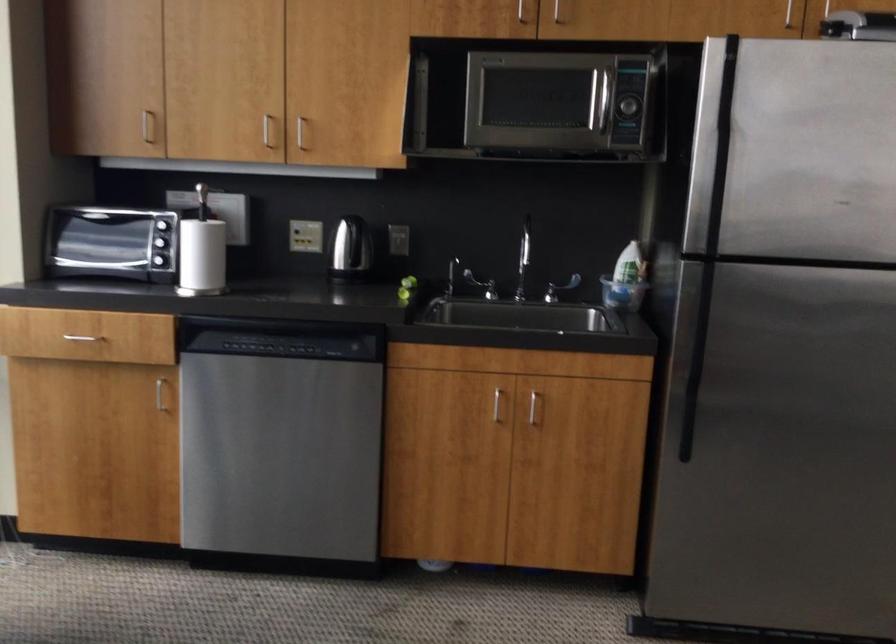
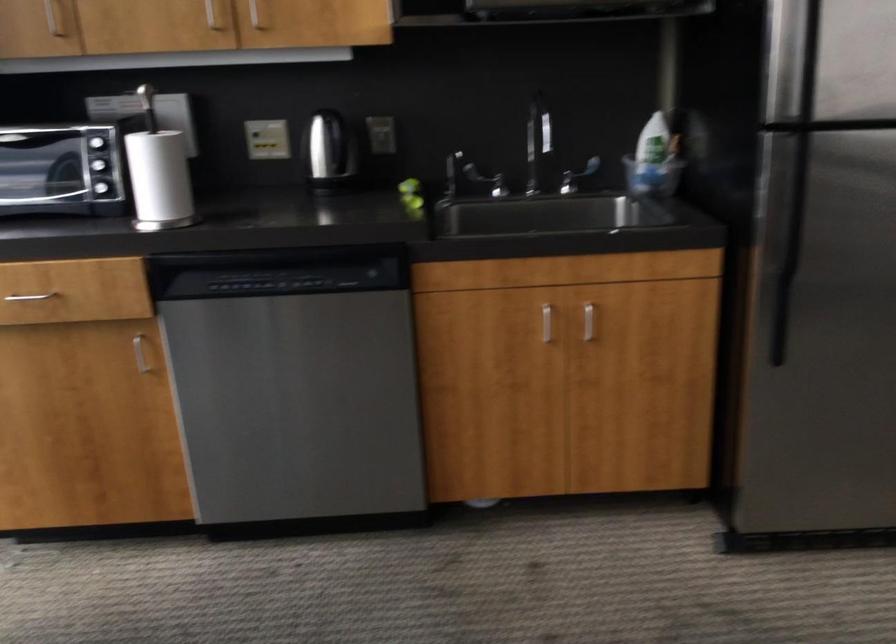
Locate, in the second image, the point that corresponds to (x=561, y=290) in the first image.

(576, 176)